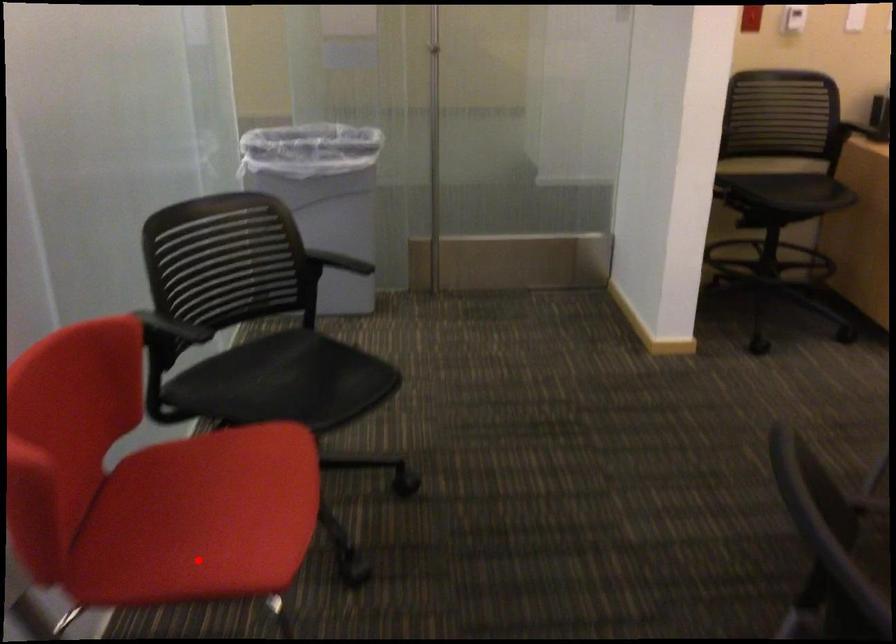
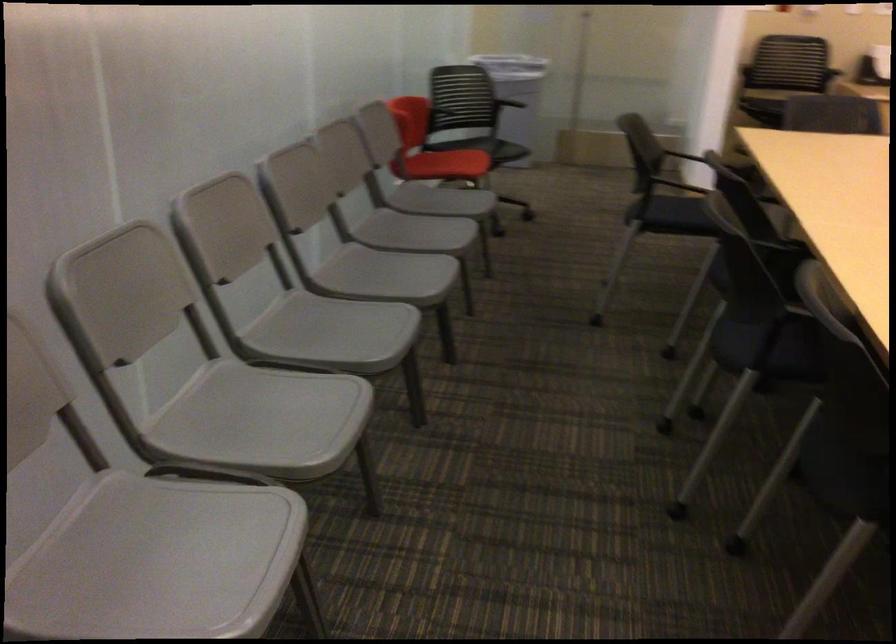
Question: A red point is marked in image1. In image2, is the corresponding 3D point closer to the camera or farther? Reply with the corresponding letter.

Choices:
 (A) The corresponding 3D point is closer.
 (B) The corresponding 3D point is farther.

Answer: (B)